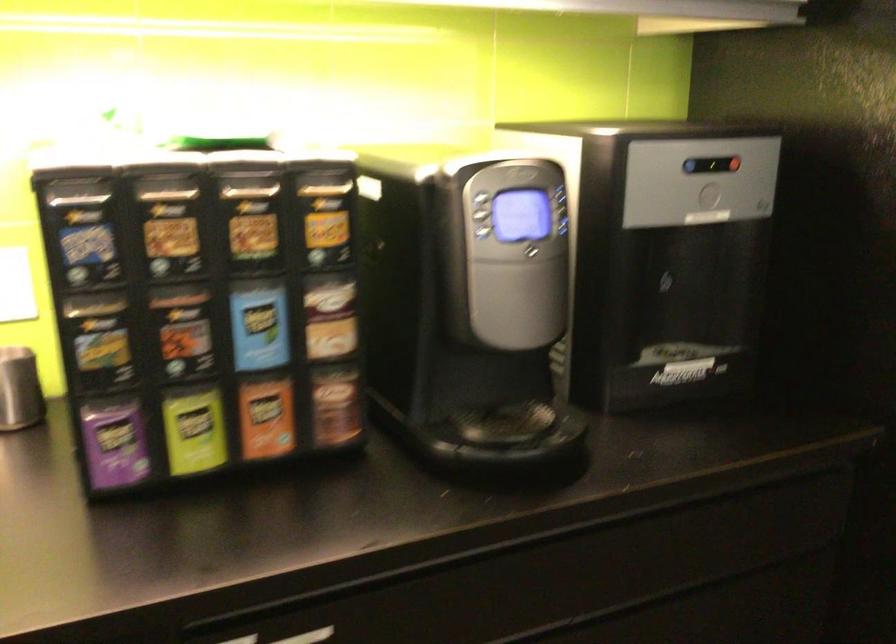
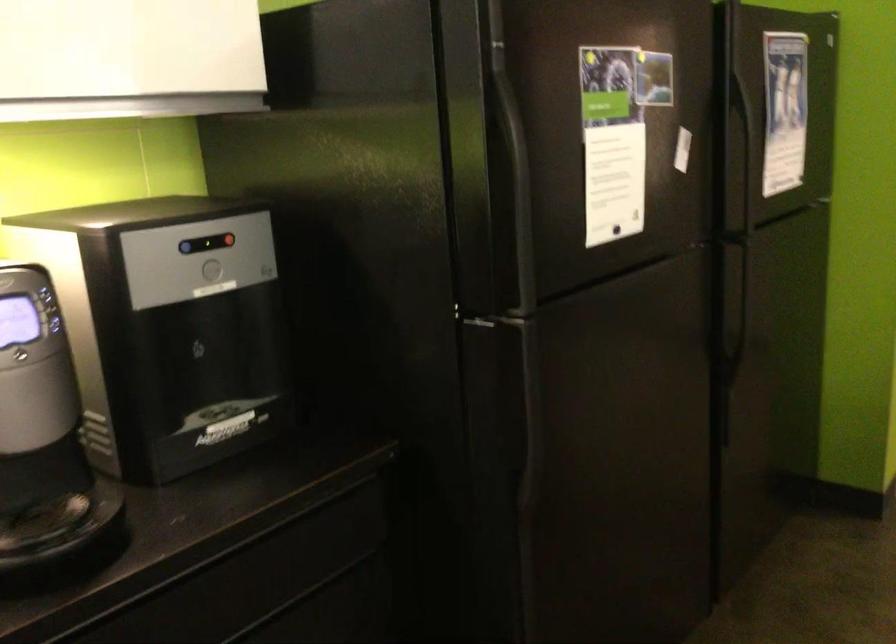
The point at (708, 192) is marked in the first image. Where is the corresponding point in the second image?

(211, 269)